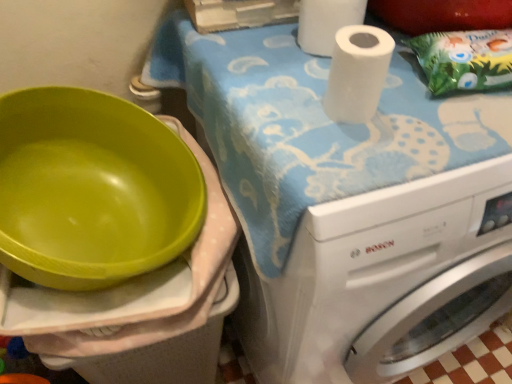
Locate an element on the screen. Image resolution: width=512 pixels, height=384 pixels. blank space to the left of white matte paper towel at upper right, which appears as the 1th paper towel when viewed from the back is located at coordinates (258, 50).